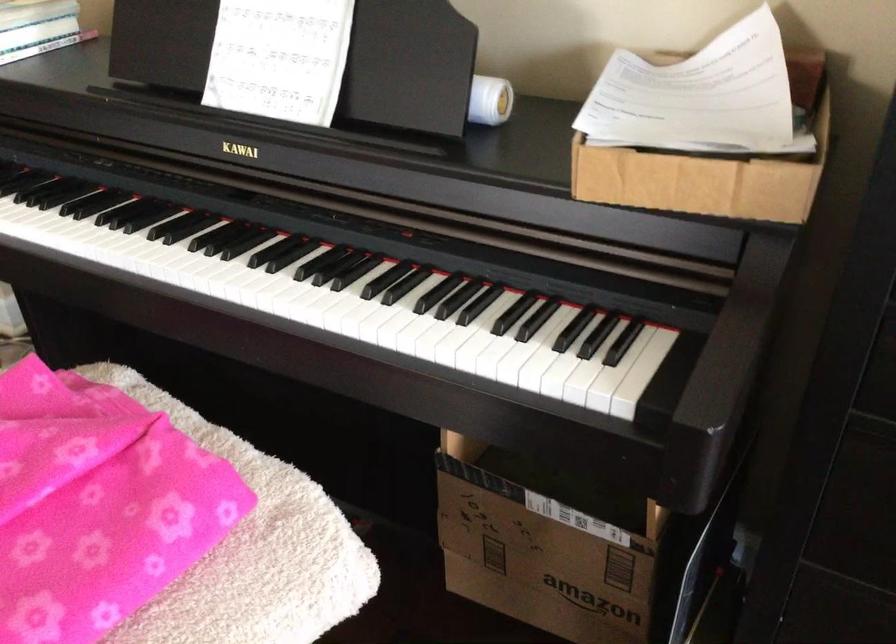
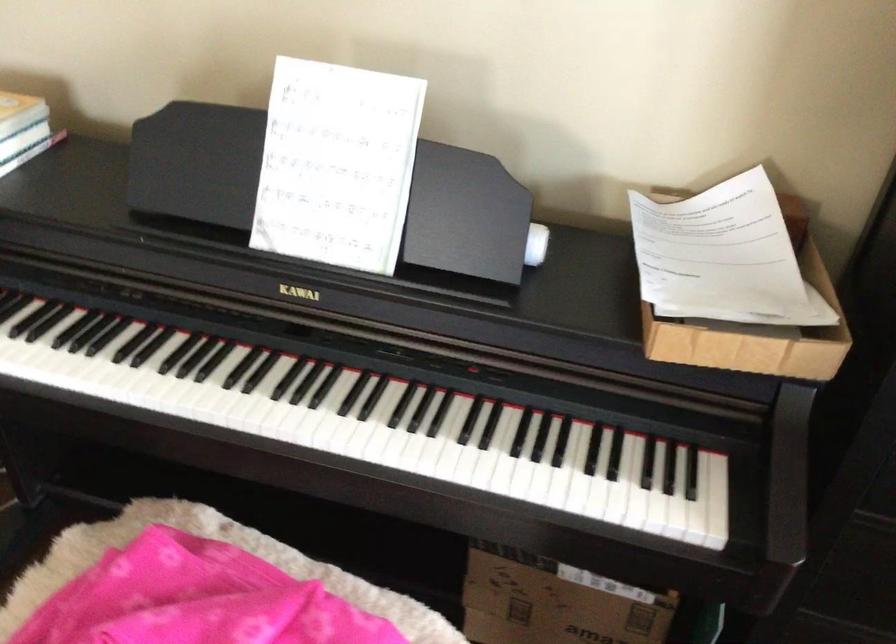
Locate, in the second image, the point that corresponds to the point at 156,259 in the first image.

(245, 412)